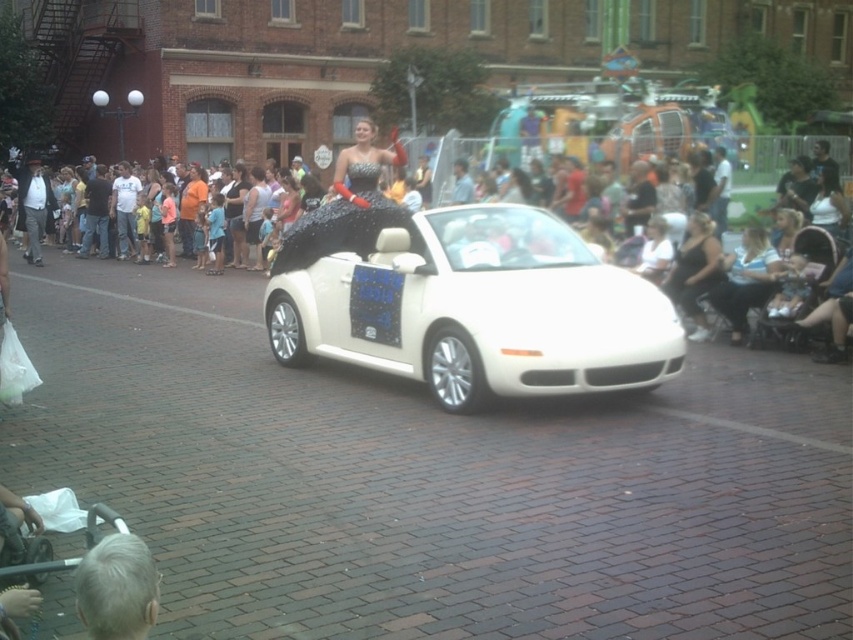
You are a photographer standing on the sidewalk. You want to take a photo of both the white glossy convertible at center and the sparkly black dress at center. Which object should you focus on first if you want to ensure both are in the frame?

The white glossy convertible at center is shorter than the sparkly black dress at center, so you should focus on the sparkly black dress at center first to ensure both are in the frame.

You are a photographer standing on the sidewalk during the parade. You want to take a photo that includes both the white glossy convertible at center and the matte black dress at center. Based on their positions, will the convertible be visible in the frame if you focus on the dress?

Yes, the white glossy convertible at center is below the matte black dress at center, so if you focus on the dress, the convertible will still be visible in the lower part of the frame.

Based on the photo, you are a photographer standing on the sidewalk, and you want to take a photo of the white glossy convertible at center and the sparkly black dress at center in the same frame. The minimum distance between the two subjects for your camera to focus properly is 8 feet. Will you be able to capture both in focus?

The distance between the white glossy convertible at center and the sparkly black dress at center is 7.50 feet, which is less than the required 8 feet for proper focus. Therefore, you might struggle to keep both in focus simultaneously.